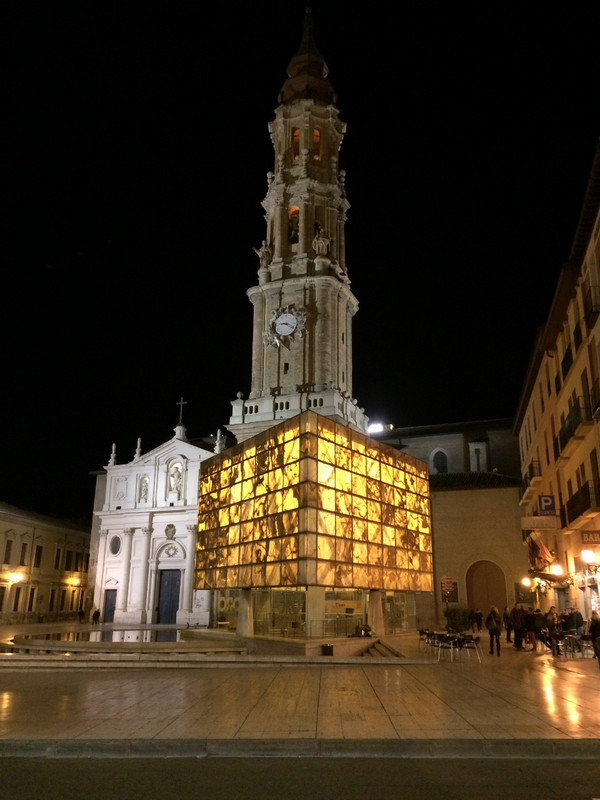
The image size is (600, 800). I want to click on clock, so click(285, 329).